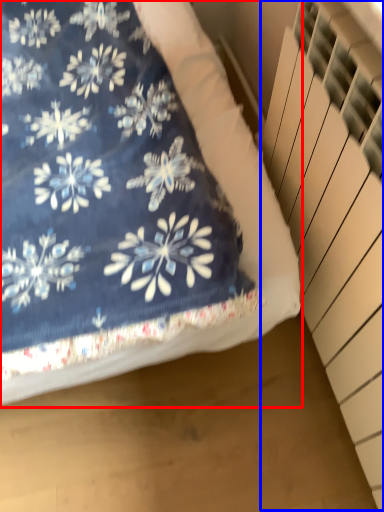
Question: Which object is closer to the camera taking this photo, bed (highlighted by a red box) or stairwell (highlighted by a blue box)?

Choices:
 (A) bed
 (B) stairwell

Answer: (B)